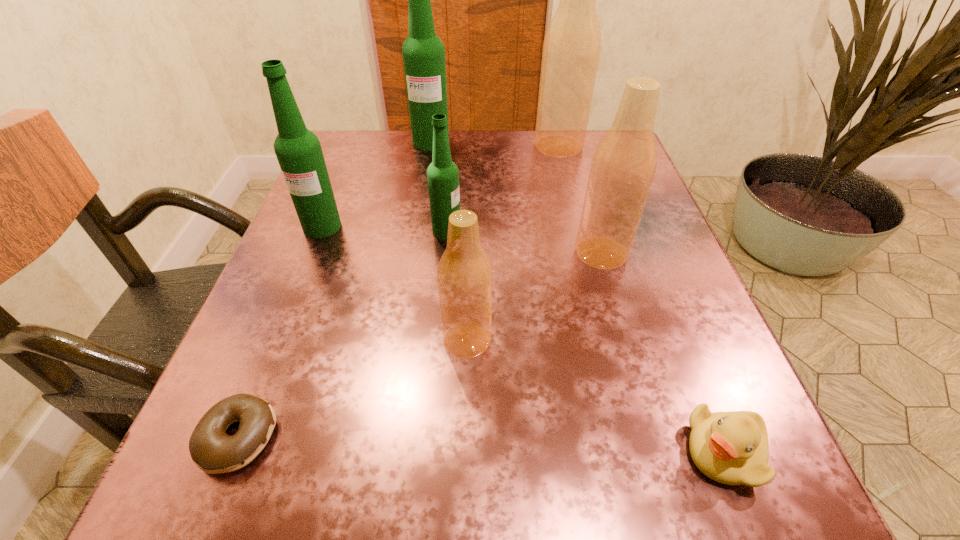
In the image, there is a desktop. At what (x,y) coordinates should I click in order to perform the action: click on blank space at the far edge. Please return your answer as a coordinate pair (x, y). The height and width of the screenshot is (540, 960). Looking at the image, I should click on (474, 154).

Identify the location of vacant space at the near edge. (483, 531).

Find the location of a particular element. The image size is (960, 540). vacant area at the left edge of the desktop is located at coordinates (260, 344).

The height and width of the screenshot is (540, 960). I want to click on vacant space at the right edge of the desktop, so click(683, 366).

Image resolution: width=960 pixels, height=540 pixels. What are the coordinates of `vacant space at the far left corner of the desktop` in the screenshot? It's located at (401, 133).

In the image, there is a desktop. Where is `free space at the near left corner`? This screenshot has width=960, height=540. free space at the near left corner is located at coordinates (235, 491).

Locate an element on the screen. vacant area at the far right corner is located at coordinates (603, 132).

Locate an element on the screen. The height and width of the screenshot is (540, 960). vacant space in between the smallest green beer bottle and the second nearest tan beer bottle is located at coordinates (524, 241).

In order to click on vacant area between the farthest green beer bottle and the second smallest green beer bottle in this screenshot , I will do `click(376, 184)`.

You are a GUI agent. You are given a task and a screenshot of the screen. Output one action in this format:
    pyautogui.click(x=<x>, y=<y>)
    Task: Click on the unoccupied area between the farthest tan beer bottle and the leftmost tan beer bottle
    The width and height of the screenshot is (960, 540).
    Given the screenshot: What is the action you would take?
    pyautogui.click(x=513, y=243)